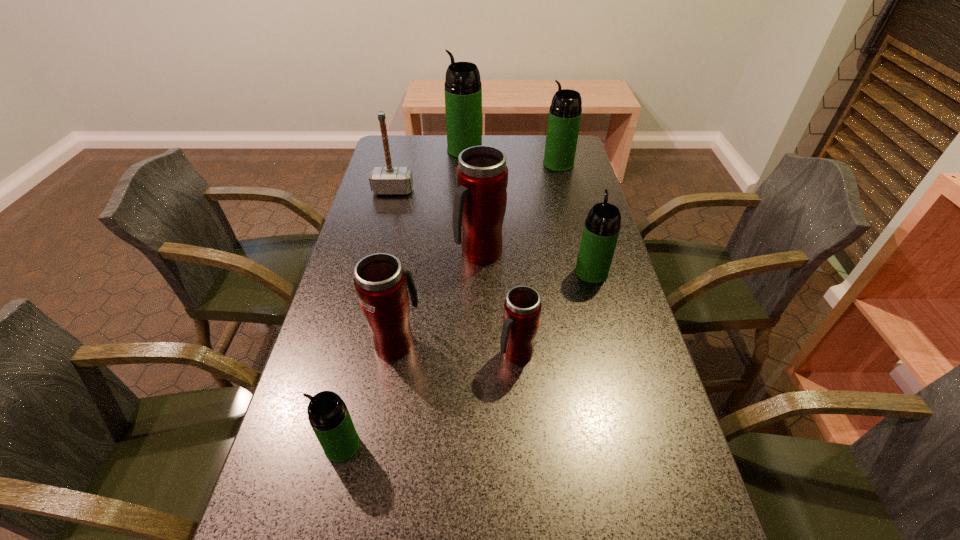
Where is `blank space that satisfies the following two spatial constraints: 1. from the spout of the biggest green thermos bottle; 2. from the spout of the third biggest green thermos bottle`? The width and height of the screenshot is (960, 540). blank space that satisfies the following two spatial constraints: 1. from the spout of the biggest green thermos bottle; 2. from the spout of the third biggest green thermos bottle is located at coordinates (459, 272).